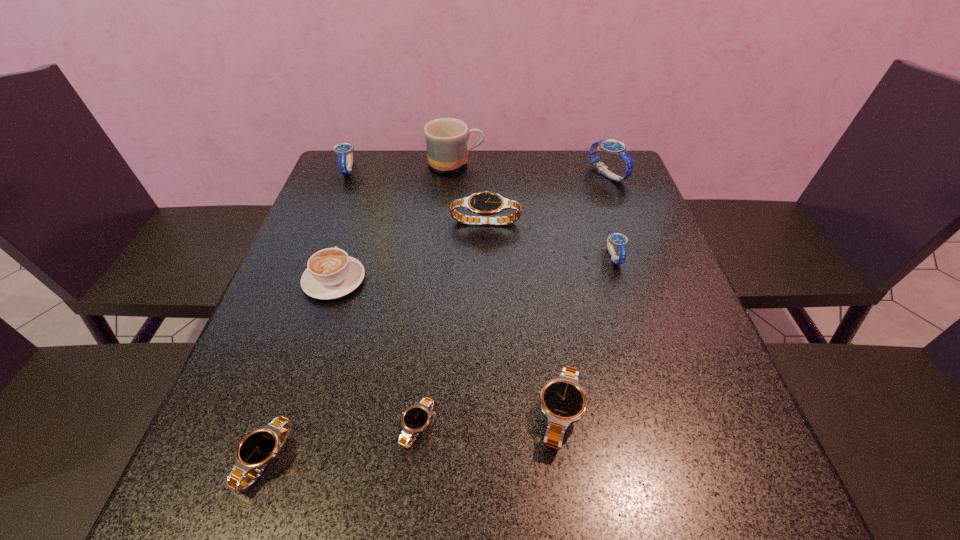
I want to click on blue watch identified as the second closest to the blue mug, so click(x=614, y=147).

Point out which black watch is positioned as the second nearest to the tallest watch. Please provide its 2D coordinates. Your answer should be formatted as a tuple, i.e. [(x, y)], where the tuple contains the x and y coordinates of a point satisfying the conditions above.

[(563, 401)]

Identify the location of black watch that is the third nearest to the mug. The width and height of the screenshot is (960, 540). (416, 418).

You are a GUI agent. You are given a task and a screenshot of the screen. Output one action in this format:
    pyautogui.click(x=<x>, y=<y>)
    Task: Click on the vacant space that satisfies the following two spatial constraints: 1. on the side with the handle of the mug; 2. on the front side of the shortest object
    
    Given the screenshot: What is the action you would take?
    pyautogui.click(x=437, y=427)

The width and height of the screenshot is (960, 540). Identify the location of vacant area in the image that satisfies the following two spatial constraints: 1. on the back side of the nearest blue watch; 2. on the side with the handle of the mug. (584, 164).

Image resolution: width=960 pixels, height=540 pixels. What are the coordinates of `blank space that satisfies the following two spatial constraints: 1. on the front side of the third smallest black watch; 2. on the left side of the leftmost blue watch` in the screenshot? It's located at (252, 415).

Image resolution: width=960 pixels, height=540 pixels. In order to click on vacant space that satisfies the following two spatial constraints: 1. on the front side of the second biggest blue watch; 2. on the left side of the biggest black watch in this screenshot , I will do `click(328, 221)`.